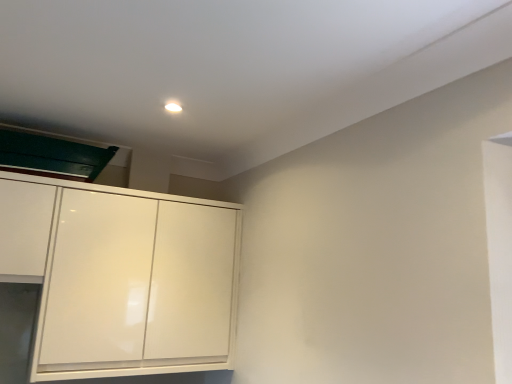
What is the approximate height of glossy white cupboard at lower left?

The height of glossy white cupboard at lower left is 31.51 inches.

In order to face glossy white cupboard at lower left, should I rotate leftwards or rightwards?

Turn left by 18.141 degrees to look at glossy white cupboard at lower left.

Measure the distance between glossy white cupboard at lower left and camera.

A distance of 5.19 feet exists between glossy white cupboard at lower left and camera.

This screenshot has height=384, width=512. I want to click on glossy white cupboard at lower left, so click(x=122, y=276).

What do you see at coordinates (122, 276) in the screenshot? I see `glossy white cupboard at lower left` at bounding box center [122, 276].

The width and height of the screenshot is (512, 384). What are the coordinates of `glossy white cupboard at lower left` in the screenshot? It's located at (122, 276).